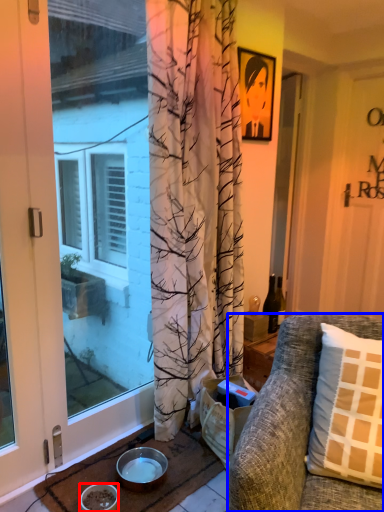
Question: Which object appears farthest to the camera in this image, bowl (highlighted by a red box) or studio couch (highlighted by a blue box)?

Choices:
 (A) bowl
 (B) studio couch

Answer: (A)